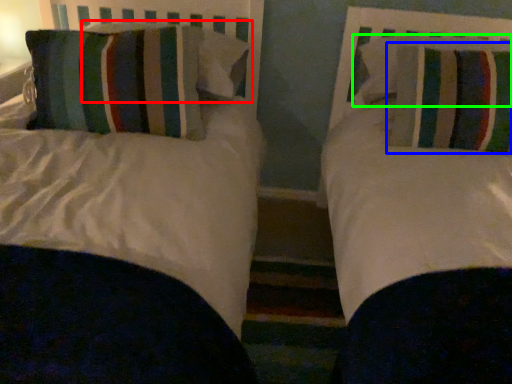
Question: Which object is the farthest from pillow (highlighted by a red box)? Choose among these: pillow (highlighted by a blue box) or pillow (highlighted by a green box).

Choices:
 (A) pillow
 (B) pillow

Answer: (A)